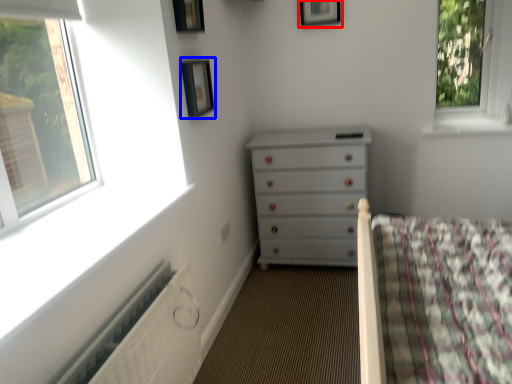
Question: Which of the following is the closest to the observer, picture frame (highlighted by a red box) or picture frame (highlighted by a blue box)?

Choices:
 (A) picture frame
 (B) picture frame

Answer: (B)